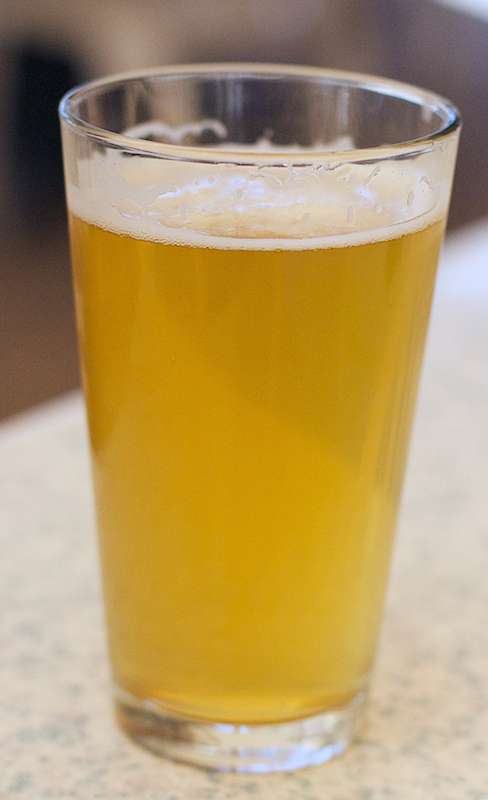
Image resolution: width=488 pixels, height=800 pixels. I want to click on front bottom base of drinking glass, so click(x=183, y=742), click(x=288, y=754).